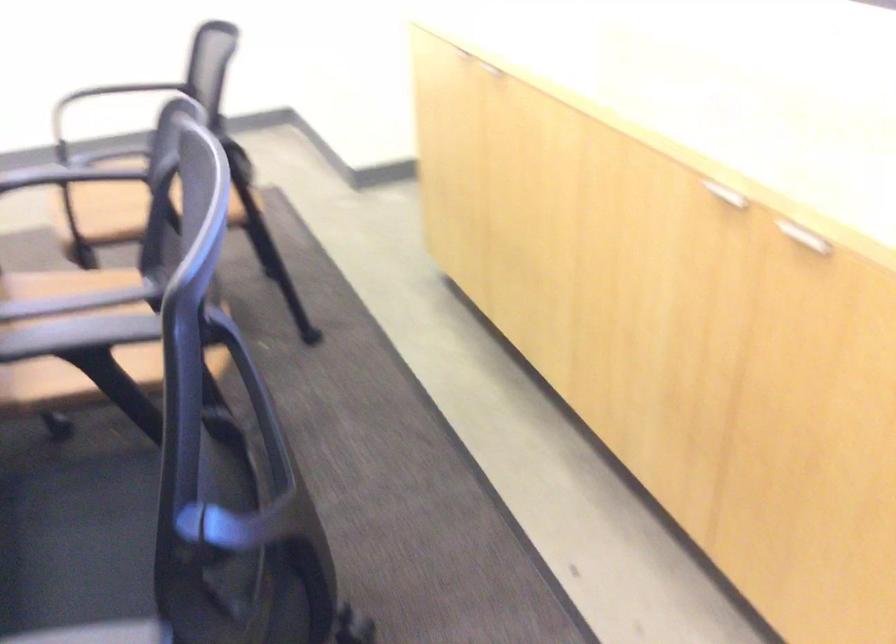
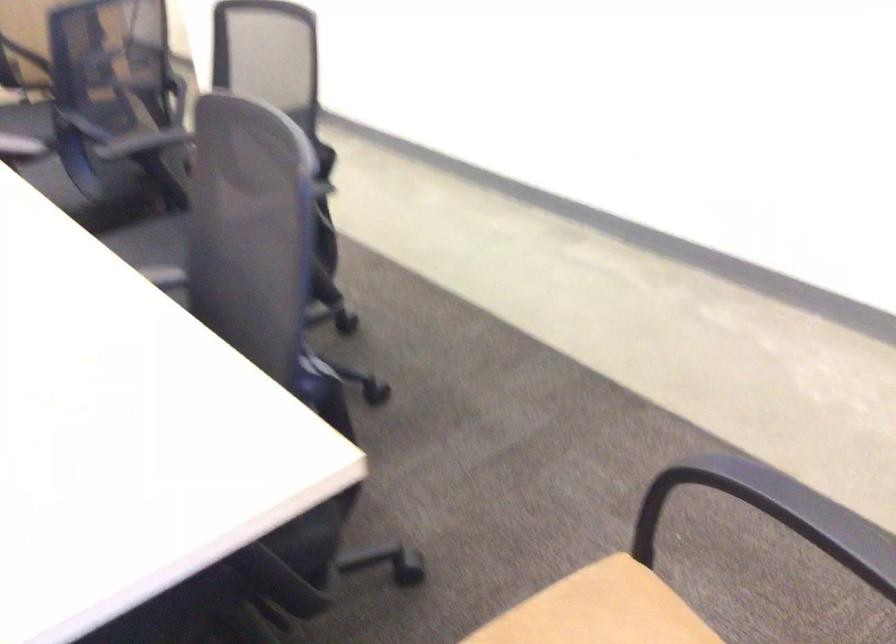
Find the pixel in the second image that matches (x=80, y=187) in the first image.

(584, 609)